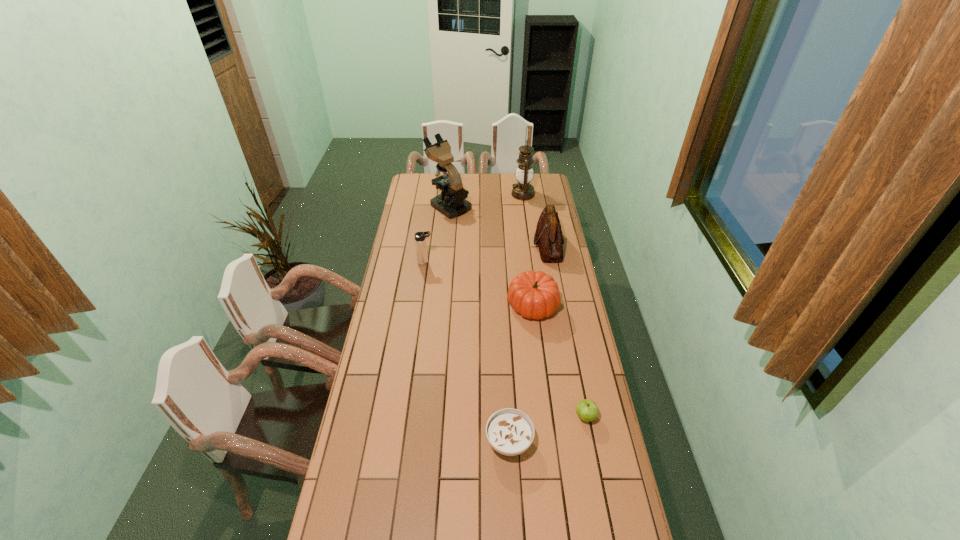
Identify the location of free space between the thermos bottle and the pumpkin. This screenshot has height=540, width=960. (479, 284).

Locate an element on the screen. vacant space that is in between the microscope and the thermos bottle is located at coordinates (438, 234).

The width and height of the screenshot is (960, 540). Identify the location of free space between the thermos bottle and the apple. (505, 340).

The image size is (960, 540). Identify the location of free space between the oil lamp and the microscope. (486, 200).

Where is `free space between the soup bowl and the thermos bottle`? The height and width of the screenshot is (540, 960). free space between the soup bowl and the thermos bottle is located at coordinates (468, 352).

Locate an element on the screen. The height and width of the screenshot is (540, 960). free spot between the oil lamp and the thermos bottle is located at coordinates (474, 228).

Image resolution: width=960 pixels, height=540 pixels. I want to click on object that is the third closest one to the oil lamp, so click(x=420, y=242).

Identify which object is located as the fifth nearest to the oil lamp. Please provide its 2D coordinates. Your answer should be formatted as a tuple, i.e. [(x, y)], where the tuple contains the x and y coordinates of a point satisfying the conditions above.

[(587, 410)]

Locate an element on the screen. The height and width of the screenshot is (540, 960). vacant point that satisfies the following two spatial constraints: 1. on the handle side of the thermos bottle; 2. on the left side of the pumpkin is located at coordinates (420, 305).

This screenshot has width=960, height=540. I want to click on vacant area in the image that satisfies the following two spatial constraints: 1. on the front side of the apple; 2. on the right side of the microscope, so (x=430, y=416).